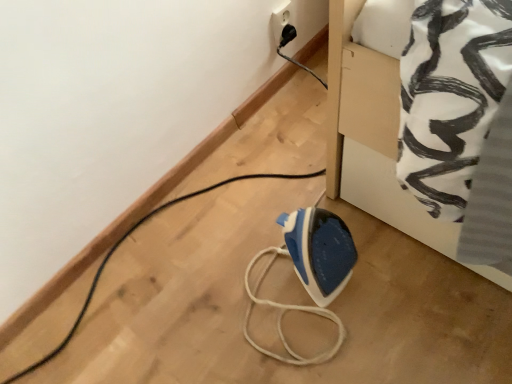
In order to face white plastic electric outlet at upper right, should I rotate leftwards or rightwards?

Turn right by 3.781 degrees to look at white plastic electric outlet at upper right.

The height and width of the screenshot is (384, 512). In order to click on white plastic electric outlet at upper right in this screenshot , I will do `click(283, 25)`.

The width and height of the screenshot is (512, 384). What do you see at coordinates (283, 25) in the screenshot? I see `white plastic electric outlet at upper right` at bounding box center [283, 25].

Measure the distance between point (291, 14) and camera.

Point (291, 14) and camera are 1.14 meters apart.

Where is `white plastic electric outlet at upper right`? The image size is (512, 384). white plastic electric outlet at upper right is located at coordinates (283, 25).